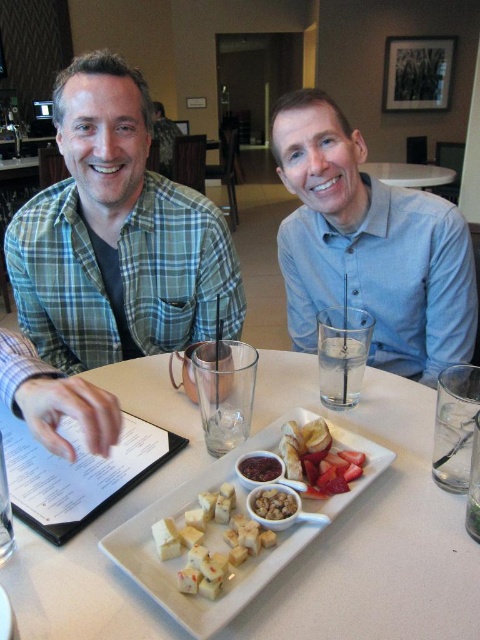
How much distance is there between green plaid shirt at upper left and crumbly brown nuts at center?

green plaid shirt at upper left and crumbly brown nuts at center are 27.91 inches apart.

Who is more forward, (14, 241) or (280, 499)?

Point (280, 499) is more forward.

Who is more distant from viewer, (x=119, y=260) or (x=271, y=493)?

The point (x=119, y=260) is behind.

Where is `green plaid shirt at upper left`? This screenshot has height=640, width=480. green plaid shirt at upper left is located at coordinates (117, 236).

Is white glossy table at center bigger than smooth dark red jam at center?

Yes.

Can you confirm if white glossy table at center is positioned to the right of smooth dark red jam at center?

Indeed, white glossy table at center is positioned on the right side of smooth dark red jam at center.

Where is `white glossy table at center`? white glossy table at center is located at coordinates (408, 173).

At what (x,y) coordinates should I click in order to perform the action: click on white glossy table at center. Please return your answer as a coordinate pair (x, y). Looking at the image, I should click on (408, 173).

Who is higher up, matte black shirt at upper left or light blue button-down shirt at center?

Answer: matte black shirt at upper left is above.

Is point (38, 333) farther from camera compared to point (405, 246)?

Yes, it is behind point (405, 246).

Who is more forward, (168, 346) or (319, 300)?

Point (168, 346) is more forward.

Identify the location of matte black shirt at upper left. (117, 236).